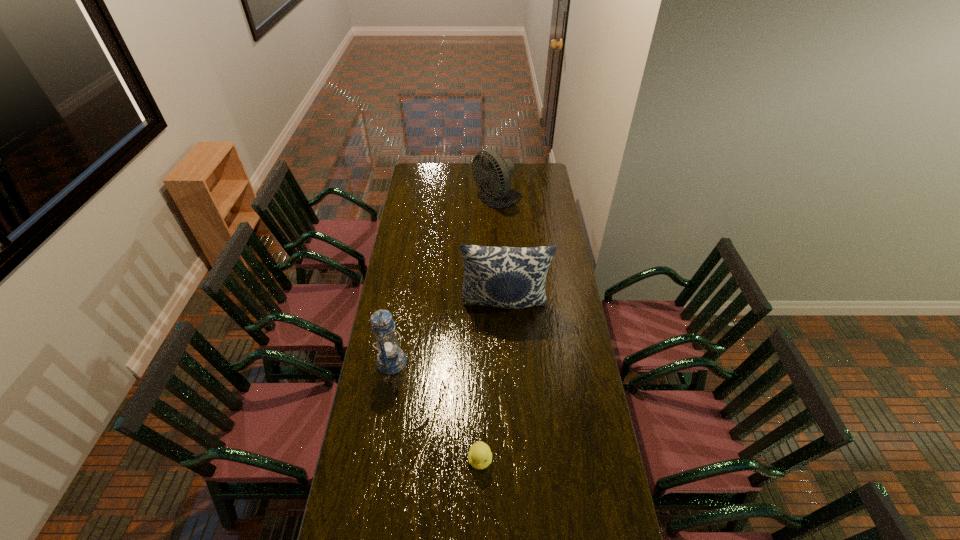
The width and height of the screenshot is (960, 540). I want to click on vacant space located 0.310m on the front-facing side of the leftmost object, so (481, 361).

Identify the location of free space located 0.110m at the beak of the nearest object. (480, 508).

Where is `object that is positioned at the left edge`? object that is positioned at the left edge is located at coordinates (391, 359).

This screenshot has height=540, width=960. I want to click on object at the right edge, so click(508, 277).

In the image, there is a desktop. Where is `vacant space at the far edge`? vacant space at the far edge is located at coordinates (466, 173).

The width and height of the screenshot is (960, 540). I want to click on vacant space at the left edge of the desktop, so click(403, 311).

Where is `free space at the right edge of the desktop`? The width and height of the screenshot is (960, 540). free space at the right edge of the desktop is located at coordinates (533, 211).

This screenshot has width=960, height=540. I want to click on free area in between the third farthest object and the third nearest object, so click(x=448, y=333).

Find the location of a particular element. Image resolution: width=960 pixels, height=540 pixels. empty location between the third farthest object and the fan is located at coordinates (444, 281).

The width and height of the screenshot is (960, 540). I want to click on free space between the farthest object and the leftmost object, so click(444, 281).